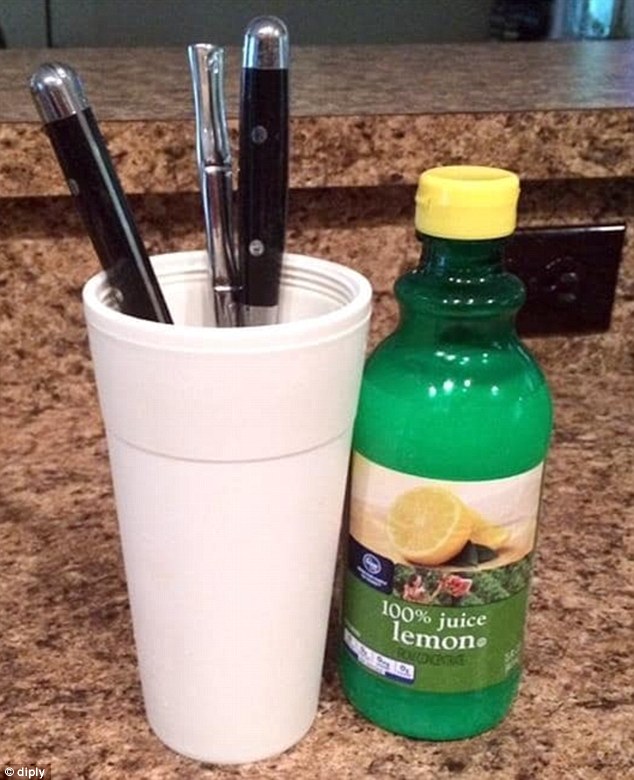
Image resolution: width=634 pixels, height=780 pixels. What are the coordinates of `knives` in the screenshot? It's located at (104, 197), (269, 260).